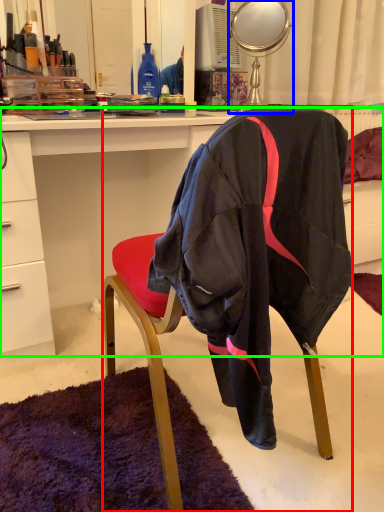
Question: Estimate the real-world distances between objects in this image. Which object is closer to chair (highlighted by a red box), mirror (highlighted by a blue box) or desk (highlighted by a green box)?

Choices:
 (A) mirror
 (B) desk

Answer: (B)